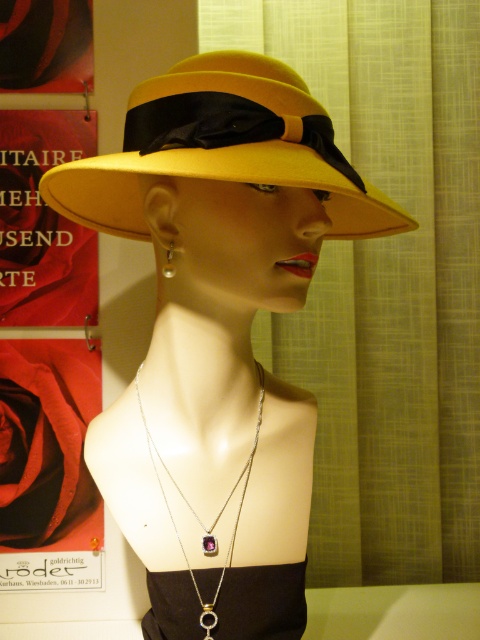
You are a fashion designer trying to decide which hat to feature in your upcoming collection. You have two options in front of you, the matte yellow hat at center and the yellow felt hat at center. Based on their height, which one would you choose if you want a more dramatic look?

The matte yellow hat at center is much taller than the yellow felt hat at center, so it would be the better choice for a more dramatic look due to its increased height.